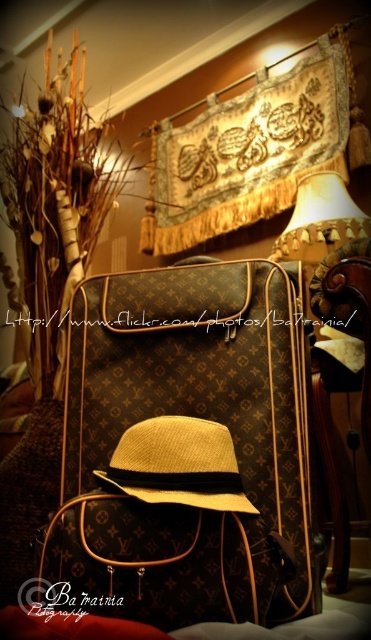
Question: Does brown leather chair at center appear over straw fedora at center?

Choices:
 (A) yes
 (B) no

Answer: (B)

Question: Which point is closer to the camera?

Choices:
 (A) (336, 493)
 (B) (304, 186)
 (C) (300, 584)
 (D) (176, 432)

Answer: (C)

Question: Can you confirm if brown monogrammed suitcase at center is thinner than brown leather chair at center?

Choices:
 (A) yes
 (B) no

Answer: (B)

Question: Which object is positioned closest to the brown monogrammed suitcase at center?

Choices:
 (A) beige fabric lampshade at upper right
 (B) straw fedora at center
 (C) brown leather chair at center

Answer: (B)

Question: Which point is closer to the camera?

Choices:
 (A) straw fedora at center
 (B) brown monogrammed suitcase at center
 (C) beige fabric lampshade at upper right
 (D) brown leather chair at center

Answer: (B)

Question: Is brown leather chair at center thinner than beige fabric lampshade at upper right?

Choices:
 (A) no
 (B) yes

Answer: (B)